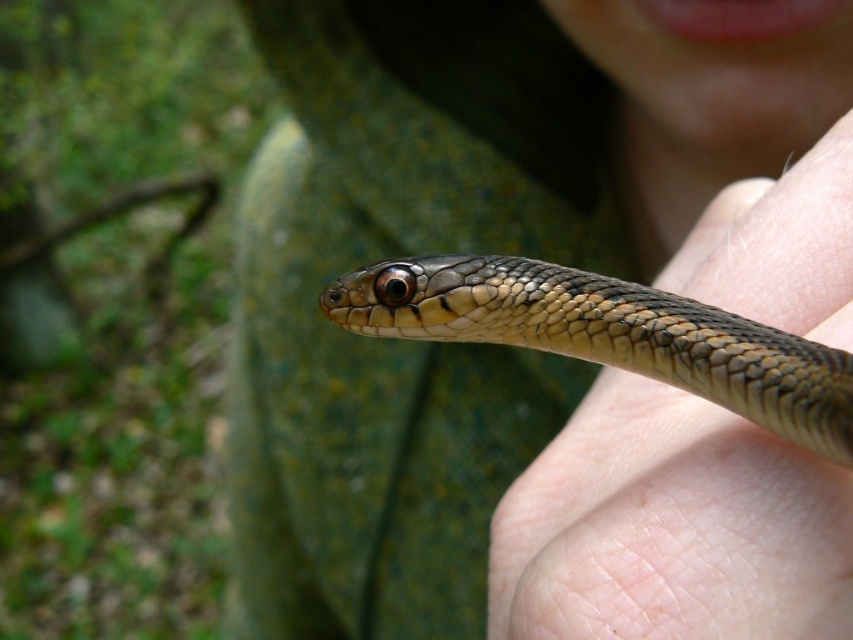
You are a wildlife photographer trying to capture a close shot of the shiny brown snake at center. You notice the smooth skin hand at center holding it. Based on their sizes, will the hand block the snake from being fully visible in your photo?

The smooth skin hand at center is taller than shiny brown snake at center, so the hand will block the snake from being fully visible in the photo.

You are a biologist observing the snake in the image. You notice the smooth skin at center and the shiny brown snake at center. Which object is positioned to the right of the other?

The smooth skin at center is to the right of the shiny brown snake at center.